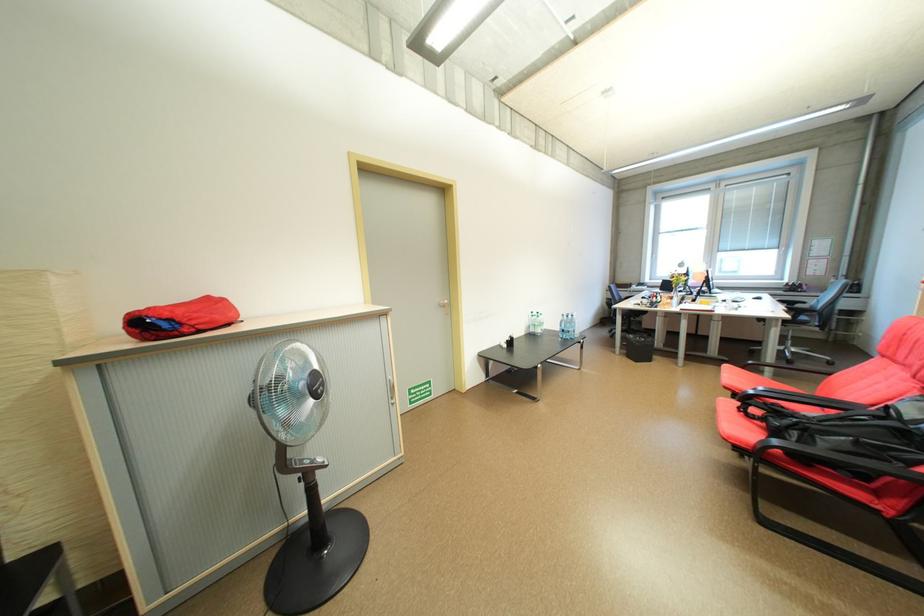
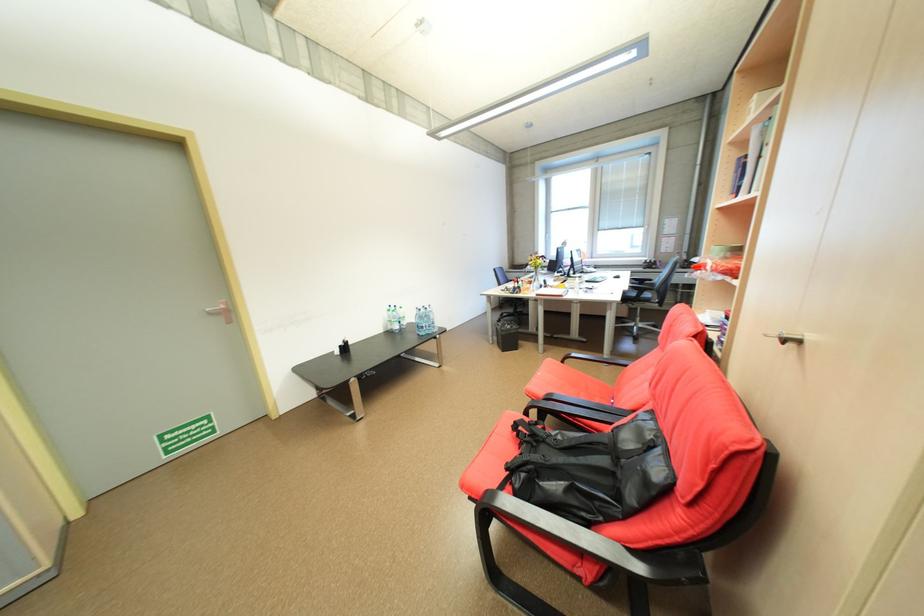
Question: Which direction would the cameraman need to move to produce the second image? Reply with the corresponding letter.

Choices:
 (A) Left
 (B) Right
 (C) Forward
 (D) Backward

Answer: (B)